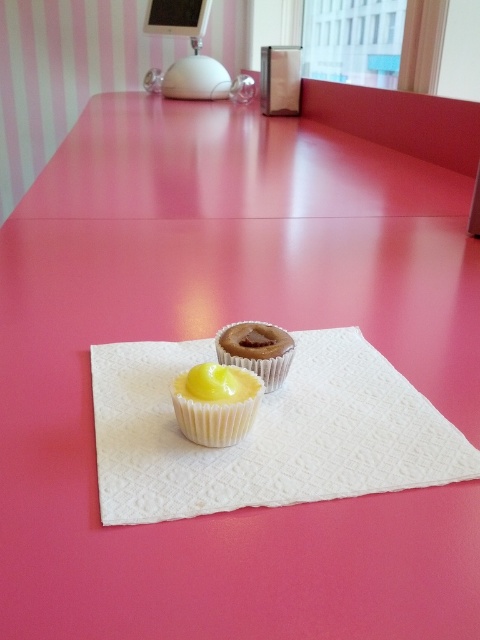
Question: Which point is farther from the camera taking this photo?

Choices:
 (A) (205, 442)
 (B) (225, 358)

Answer: (B)

Question: Is yellow matte muffin at center above chocolate matte muffin at center?

Choices:
 (A) no
 (B) yes

Answer: (A)

Question: Is yellow matte muffin at center wider than chocolate matte muffin at center?

Choices:
 (A) no
 (B) yes

Answer: (A)

Question: Can you confirm if yellow matte muffin at center is positioned to the left of chocolate matte muffin at center?

Choices:
 (A) yes
 (B) no

Answer: (A)

Question: Which of the following is the farthest from the observer?

Choices:
 (A) (271, 324)
 (B) (187, 408)

Answer: (A)